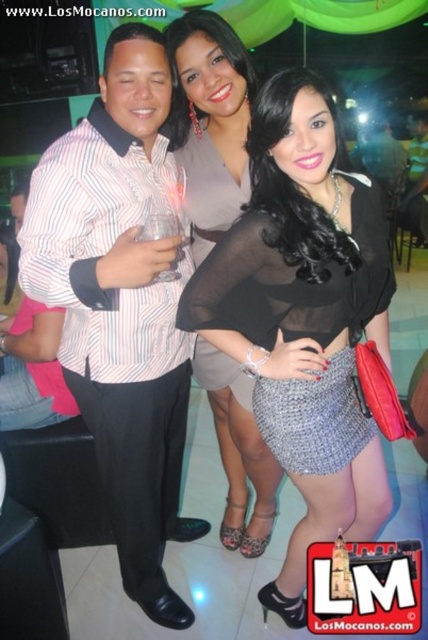
You are a photographer at the event and need to adjust the lighting to ensure both the black sheer blouse at center and the matte gray dress at center are equally visible. Considering their widths, which garment requires more focused lighting to maintain visibility?

The black sheer blouse at center is wider than the matte gray dress at center. Since the black sheer blouse at center has a greater width, it would require more focused lighting to ensure its entire surface is adequately illuminated compared to the narrower matte gray dress at center.

You are a photographer at the event and need to decide which dress to focus on for a closeup shot. Since the matte gray dress at center and the black sheer dress at center are both at the center, which one will appear bigger in your photo?

The matte gray dress at center will appear bigger in the photo because it is larger in size than the black sheer dress at center.

You are a photographer at the event and want to ensure the black sheer blouse at center and the black sheer dress at center are both visible in the photo. Given their sizes, which one might you need to adjust the camera angle to better highlight?

The black sheer blouse at center is bigger than the black sheer dress at center, so you might need to adjust the camera angle to better highlight the smaller black sheer dress at center to ensure it is visible alongside the larger blouse.